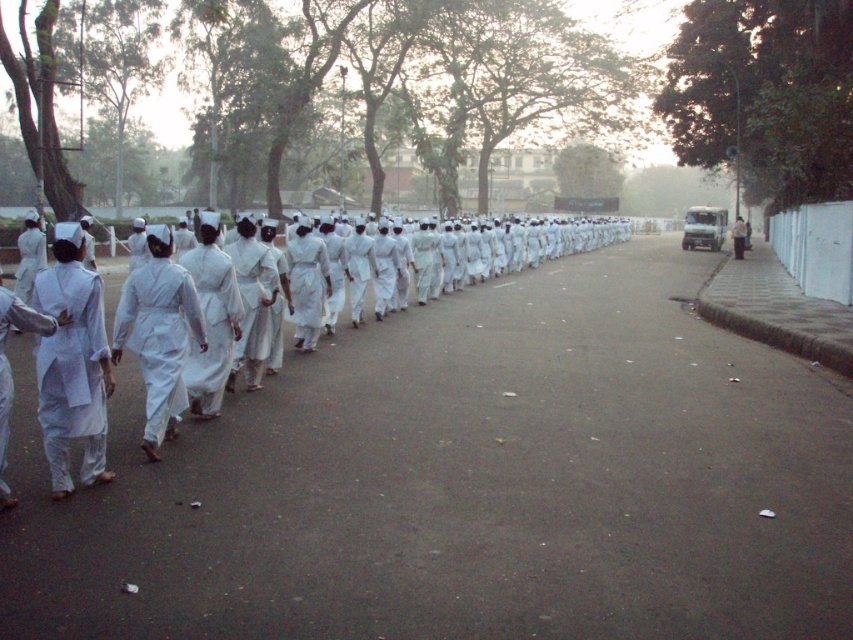
Question: Can you confirm if white cloth uniform at center is bigger than white matte uniform at left?

Choices:
 (A) yes
 (B) no

Answer: (A)

Question: Estimate the real-world distances between objects in this image. Which object is closer to the white cloth dress at center?

Choices:
 (A) white cotton dress at left
 (B) white matte uniform at center

Answer: (B)

Question: Which of the following is the closest to the observer?

Choices:
 (A) (138, 312)
 (B) (67, 474)
 (C) (39, 317)

Answer: (C)

Question: In this image, where is dark asphalt road at center located relative to white cloth dress at center?

Choices:
 (A) right
 (B) left

Answer: (B)

Question: Does dark asphalt road at center appear on the left side of white matte uniform at center?

Choices:
 (A) no
 (B) yes

Answer: (A)

Question: Which of the following is the closest to the observer?

Choices:
 (A) (22, 323)
 (B) (38, 300)

Answer: (A)